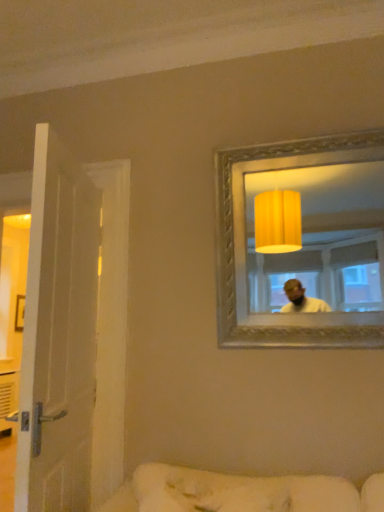
Question: Considering the relative positions of white wooden door at left and white fabric couch at lower center in the image provided, is white wooden door at left to the right of white fabric couch at lower center from the viewer's perspective?

Choices:
 (A) no
 (B) yes

Answer: (A)

Question: Is the position of white wooden door at left more distant than that of white fabric couch at lower center?

Choices:
 (A) yes
 (B) no

Answer: (A)

Question: Can you confirm if white wooden door at left is thinner than white fabric couch at lower center?

Choices:
 (A) no
 (B) yes

Answer: (A)

Question: Is white wooden door at left in contact with white fabric couch at lower center?

Choices:
 (A) no
 (B) yes

Answer: (A)

Question: Can you confirm if white wooden door at left is smaller than white fabric couch at lower center?

Choices:
 (A) yes
 (B) no

Answer: (B)

Question: Does white wooden door at left have a lesser height compared to white fabric couch at lower center?

Choices:
 (A) no
 (B) yes

Answer: (A)

Question: Considering the relative sizes of gold textured mirror at upper right and white fabric couch at lower center in the image provided, is gold textured mirror at upper right taller than white fabric couch at lower center?

Choices:
 (A) yes
 (B) no

Answer: (A)

Question: From a real-world perspective, is gold textured mirror at upper right positioned under white fabric couch at lower center based on gravity?

Choices:
 (A) no
 (B) yes

Answer: (A)

Question: From the image's perspective, is gold textured mirror at upper right located beneath white fabric couch at lower center?

Choices:
 (A) yes
 (B) no

Answer: (B)

Question: Is gold textured mirror at upper right outside of white fabric couch at lower center?

Choices:
 (A) no
 (B) yes

Answer: (B)

Question: Is gold textured mirror at upper right facing away from white fabric couch at lower center?

Choices:
 (A) yes
 (B) no

Answer: (B)

Question: Can you confirm if gold textured mirror at upper right is bigger than white fabric couch at lower center?

Choices:
 (A) yes
 (B) no

Answer: (A)

Question: Does white fabric couch at lower center have a smaller size compared to gold textured mirror at upper right?

Choices:
 (A) yes
 (B) no

Answer: (A)